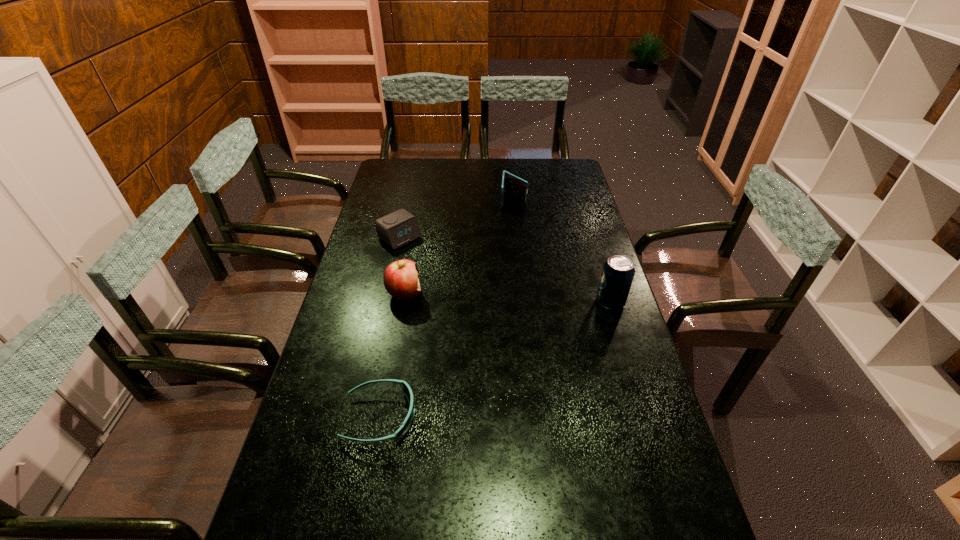
Locate an element on the screen. vacant spot on the desktop that is between the nearest object and the rightmost object and is positioned on the exterior surface of the second object from right to left is located at coordinates coord(504,355).

You are a GUI agent. You are given a task and a screenshot of the screen. Output one action in this format:
    pyautogui.click(x=<x>, y=<y>)
    Task: Click on the free spot on the desktop that is between the shortest object and the tallest object and is positioned on the bitten side of the apple
    The width and height of the screenshot is (960, 540).
    Given the screenshot: What is the action you would take?
    pyautogui.click(x=521, y=347)

Where is `free spot on the desktop that is between the shortest object and the tallest object and is positioned on the front-facing side of the alarm clock`? free spot on the desktop that is between the shortest object and the tallest object and is positioned on the front-facing side of the alarm clock is located at coordinates (534, 340).